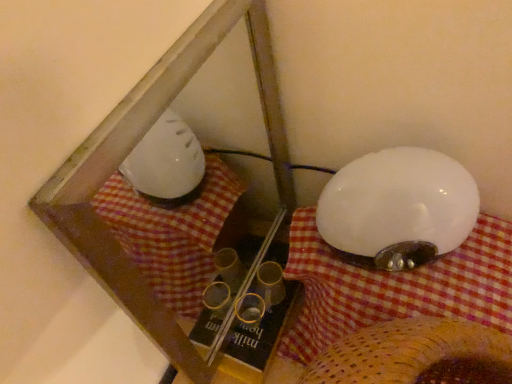
What do you see at coordinates (129, 152) in the screenshot?
I see `transparent plastic glass box at center` at bounding box center [129, 152].

What do you see at coordinates (394, 287) in the screenshot? The width and height of the screenshot is (512, 384). I see `white fabric at upper right` at bounding box center [394, 287].

The height and width of the screenshot is (384, 512). What do you see at coordinates (398, 208) in the screenshot? I see `white glossy lampshade at right` at bounding box center [398, 208].

Find the location of a particular element. Image resolution: width=512 pixels, height=384 pixels. transparent plastic glass box at center is located at coordinates pyautogui.click(x=129, y=152).

Is transparent plastic glass box at center facing towards white fabric at upper right?

Yes.

Can you confirm if transparent plastic glass box at center is positioned to the right of white fabric at upper right?

No.

Considering the relative sizes of transparent plastic glass box at center and white fabric at upper right in the image provided, is transparent plastic glass box at center shorter than white fabric at upper right?

No.

Based on the photo, what's the angular difference between transparent plastic glass box at center and white fabric at upper right's facing directions?

The angular difference between transparent plastic glass box at center and white fabric at upper right is 0.00757 degrees.

Looking at the image, does white glossy lampshade at right seem bigger or smaller compared to white fabric at upper right?

white glossy lampshade at right is smaller than white fabric at upper right.

Looking at this image, how different are the orientations of white glossy lampshade at right and white fabric at upper right in degrees?

The angular difference between white glossy lampshade at right and white fabric at upper right is 0.00125 degrees.

Is white glossy lampshade at right looking in the opposite direction of white fabric at upper right?

No.

Is white glossy lampshade at right positioned far away from white fabric at upper right?

white glossy lampshade at right is actually quite close to white fabric at upper right.

Which is more to the right, transparent plastic glass box at center or white glossy lampshade at right?

white glossy lampshade at right.

Considering the sizes of objects transparent plastic glass box at center and white glossy lampshade at right in the image provided, who is shorter, transparent plastic glass box at center or white glossy lampshade at right?

white glossy lampshade at right is shorter.

Consider the image. Is transparent plastic glass box at center spatially inside white glossy lampshade at right, or outside of it?

transparent plastic glass box at center is spatially situated outside white glossy lampshade at right.

Can you confirm if transparent plastic glass box at center is wider than white glossy lampshade at right?

In fact, transparent plastic glass box at center might be narrower than white glossy lampshade at right.

Measure the distance from white fabric at upper right to transparent plastic glass box at center.

A distance of 7.75 inches exists between white fabric at upper right and transparent plastic glass box at center.

What are the coordinates of `glass box located above the white fabric at upper right (from a real-world perspective)` in the screenshot? It's located at (129, 152).

Is white fabric at upper right aimed at transparent plastic glass box at center?

No.

From the image's perspective, is white fabric at upper right above or below transparent plastic glass box at center?

Clearly, from the image's perspective, white fabric at upper right is below transparent plastic glass box at center.

Considering the relative sizes of white glossy lampshade at right and transparent plastic glass box at center in the image provided, is white glossy lampshade at right shorter than transparent plastic glass box at center?

Indeed, white glossy lampshade at right has a lesser height compared to transparent plastic glass box at center.

Are white glossy lampshade at right and transparent plastic glass box at center located far from each other?

They are positioned close to each other.

Choose the correct answer: Is white glossy lampshade at right inside transparent plastic glass box at center or outside it?

white glossy lampshade at right is not inside transparent plastic glass box at center, it's outside.

Is white glossy lampshade at right aimed at transparent plastic glass box at center?

No, white glossy lampshade at right does not turn towards transparent plastic glass box at center.

Is white fabric at upper right not within white glossy lampshade at right?

Yes.

Between white fabric at upper right and white glossy lampshade at right, which one has more height?

white fabric at upper right is taller.

Can you confirm if white fabric at upper right is wider than white glossy lampshade at right?

Indeed, white fabric at upper right has a greater width compared to white glossy lampshade at right.

Based on their positions, is white fabric at upper right located to the left or right of white glossy lampshade at right?

Based on their positions, white fabric at upper right is located to the left of white glossy lampshade at right.

What are the coordinates of `glass box on the left of white fabric at upper right` in the screenshot? It's located at (129, 152).

Locate an element on the screen. blanket located below the white glossy lampshade at right (from the image's perspective) is located at coordinates (394, 287).

From the image, which object appears to be nearer to transparent plastic glass box at center, white glossy lampshade at right or white fabric at upper right?

white fabric at upper right.

Which object lies further to the anchor point white glossy lampshade at right, transparent plastic glass box at center or white fabric at upper right?

transparent plastic glass box at center.

From the picture: When comparing their distances from white fabric at upper right, does transparent plastic glass box at center or white glossy lampshade at right seem further?

transparent plastic glass box at center lies further to white fabric at upper right than the other object.

Which object lies nearer to the anchor point white glossy lampshade at right, white fabric at upper right or transparent plastic glass box at center?

Among the two, white fabric at upper right is located nearer to white glossy lampshade at right.

When comparing their distances from white fabric at upper right, does white glossy lampshade at right or transparent plastic glass box at center seem further?

transparent plastic glass box at center lies further to white fabric at upper right than the other object.

Which object lies nearer to the anchor point transparent plastic glass box at center, white fabric at upper right or white glossy lampshade at right?

Among the two, white fabric at upper right is located nearer to transparent plastic glass box at center.

At what (x,y) coordinates should I click in order to perform the action: click on blanket located between transparent plastic glass box at center and white glossy lampshade at right in the left-right direction. Please return your answer as a coordinate pair (x, y). The image size is (512, 384). Looking at the image, I should click on point(394,287).